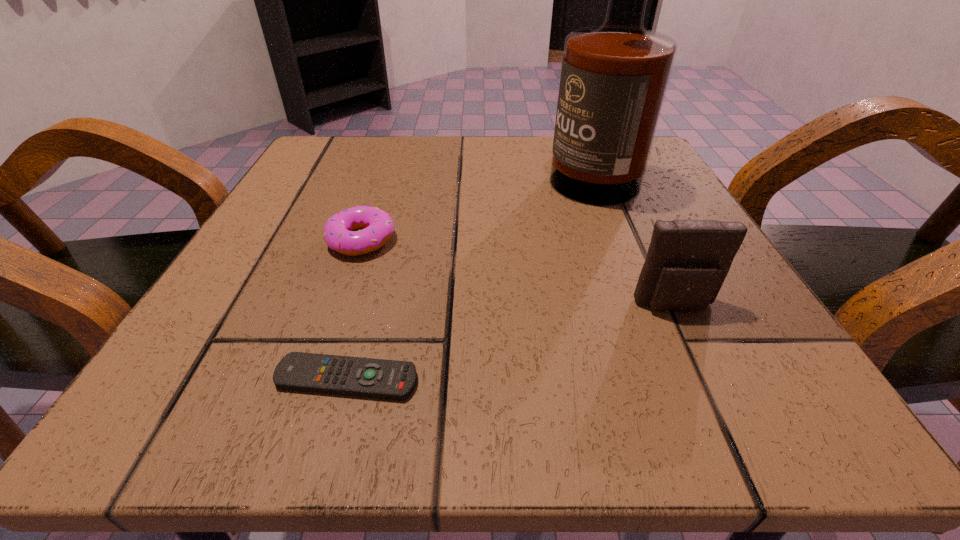
Identify the location of object at the near left corner. This screenshot has height=540, width=960. (377, 378).

Locate an element on the screen. The image size is (960, 540). object located in the far right corner section of the desktop is located at coordinates (614, 77).

Find the location of a particular element. vacant space at the far edge of the desktop is located at coordinates 433,187.

Find the location of `vacant space at the near edge of the desktop`. vacant space at the near edge of the desktop is located at coordinates (427, 364).

The width and height of the screenshot is (960, 540). Identify the location of vacant space at the left edge. (314, 230).

You are a GUI agent. You are given a task and a screenshot of the screen. Output one action in this format:
    pyautogui.click(x=<x>, y=<y>)
    Task: Click on the vacant point at the right edge
    This screenshot has width=960, height=540.
    Given the screenshot: What is the action you would take?
    pyautogui.click(x=636, y=226)

Where is `vacant point at the far left corner`? The height and width of the screenshot is (540, 960). vacant point at the far left corner is located at coordinates point(360,150).

The image size is (960, 540). I want to click on blank space at the near left corner, so click(x=237, y=378).

In the image, there is a desktop. In order to click on vacant region at the near right corner in this screenshot , I will do `click(782, 376)`.

What are the coordinates of `vacant area that lies between the third farthest object and the third tallest object` in the screenshot? It's located at (517, 273).